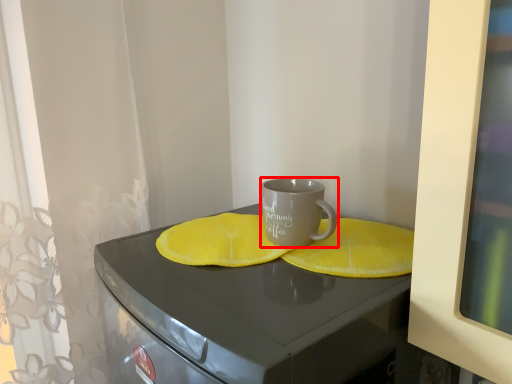
Question: From the image's perspective, what is the correct spatial relationship of coffee cup (annotated by the red box) in relation to table?

Choices:
 (A) below
 (B) above

Answer: (B)